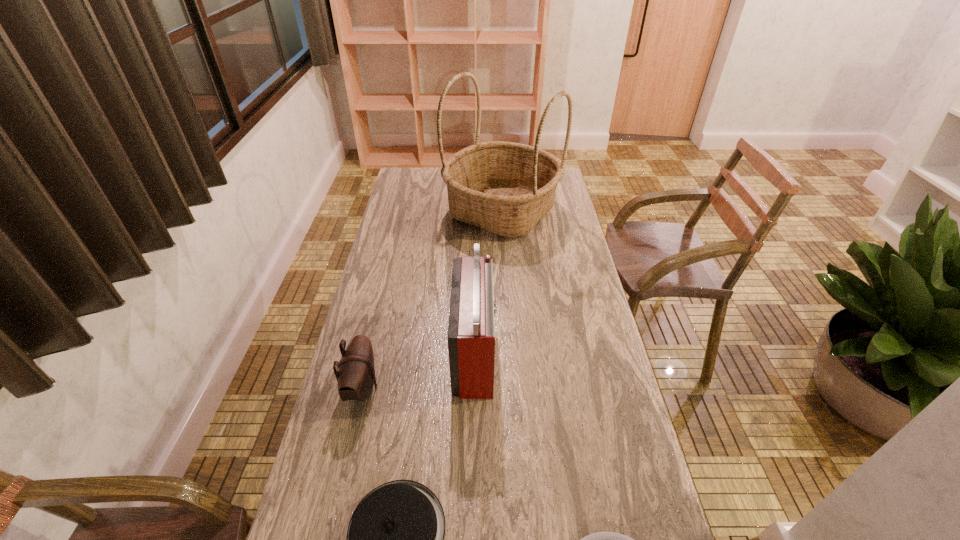
At what (x,y) coordinates should I click in order to perform the action: click on object that is at the far right corner. Please return your answer as a coordinate pair (x, y). Looking at the image, I should click on (504, 187).

Find the location of `free region at the left edge of the desktop`. free region at the left edge of the desktop is located at coordinates (368, 332).

Locate an element on the screen. The height and width of the screenshot is (540, 960). free region at the right edge of the desktop is located at coordinates (600, 407).

In the image, there is a desktop. Identify the location of vacant space at the far left corner. (398, 178).

Select which object appears as the fourth closest to the third shortest object. Please provide its 2D coordinates. Your answer should be formatted as a tuple, i.e. [(x, y)], where the tuple contains the x and y coordinates of a point satisfying the conditions above.

[(504, 187)]

Where is `object that ranks as the third closest to the pouch`? The width and height of the screenshot is (960, 540). object that ranks as the third closest to the pouch is located at coordinates (601, 539).